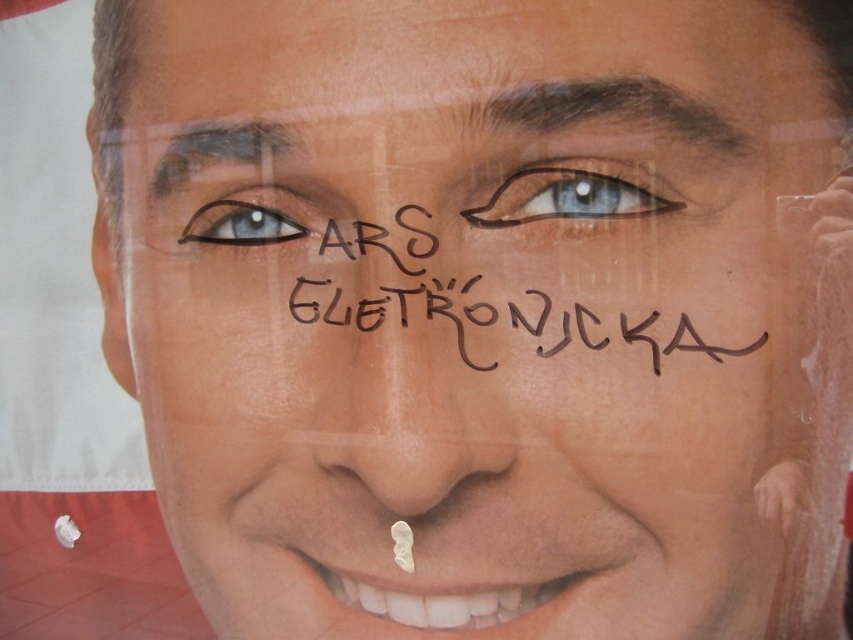
Question: Estimate the real-world distances between objects in this image. Which object is closer to the blue matte eye at upper center?

Choices:
 (A) smooth skin at upper center
 (B) brown hair at upper center

Answer: (B)

Question: Can you confirm if smooth skin at upper center is thinner than matte blue eye at upper left?

Choices:
 (A) yes
 (B) no

Answer: (A)

Question: Does black ink writing at center have a greater width compared to matte blue eye at upper left?

Choices:
 (A) no
 (B) yes

Answer: (B)

Question: Which point is closer to the camera taking this photo?

Choices:
 (A) (236, 204)
 (B) (601, 216)

Answer: (B)

Question: From the image, what is the correct spatial relationship of smooth skin at upper center in relation to matte blue eye at upper left?

Choices:
 (A) right
 (B) left

Answer: (B)

Question: Estimate the real-world distances between objects in this image. Which object is farther from the smooth skin at upper center?

Choices:
 (A) brown hair at upper center
 (B) black ink writing at center
 (C) matte blue eye at upper left
 (D) blue matte eye at upper center

Answer: (A)